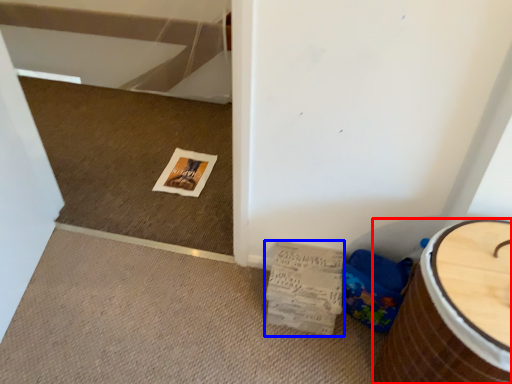
Question: Which point is closer to the camera, furniture (highlighted by a red box) or magazine (highlighted by a blue box)?

Choices:
 (A) furniture
 (B) magazine

Answer: (A)